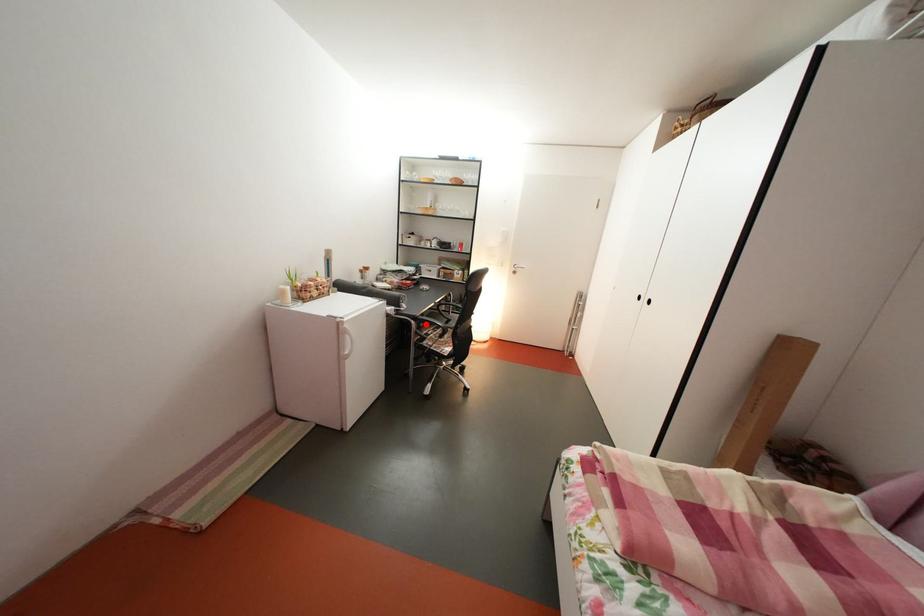
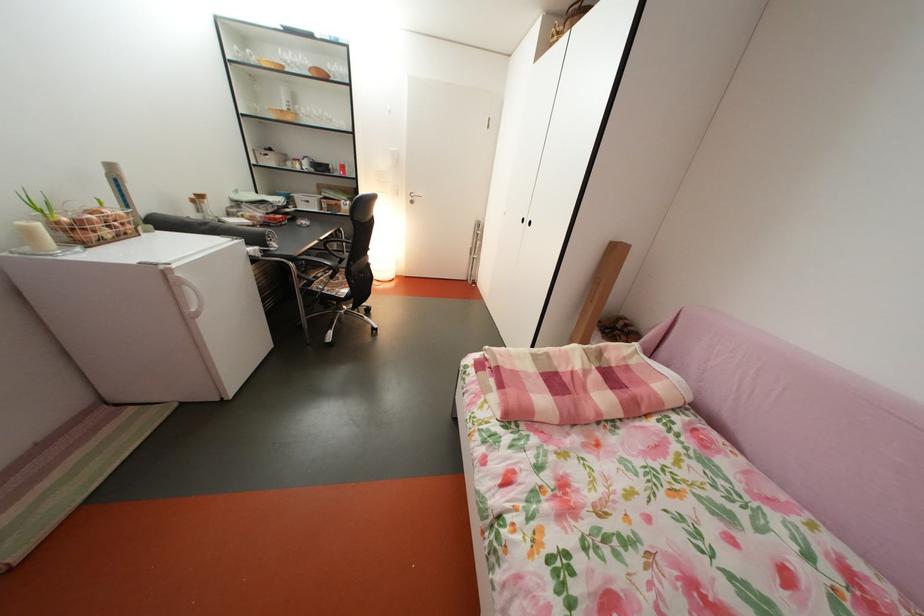
The point at the highlighted location is marked in the first image. Where is the corresponding point in the second image?

(304, 265)